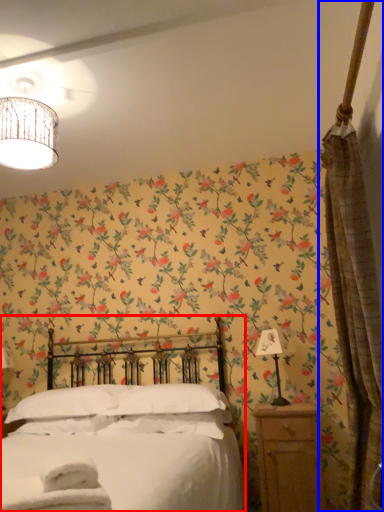
Question: Which object is closer to the camera taking this photo, bed (highlighted by a red box) or curtain (highlighted by a blue box)?

Choices:
 (A) bed
 (B) curtain

Answer: (A)